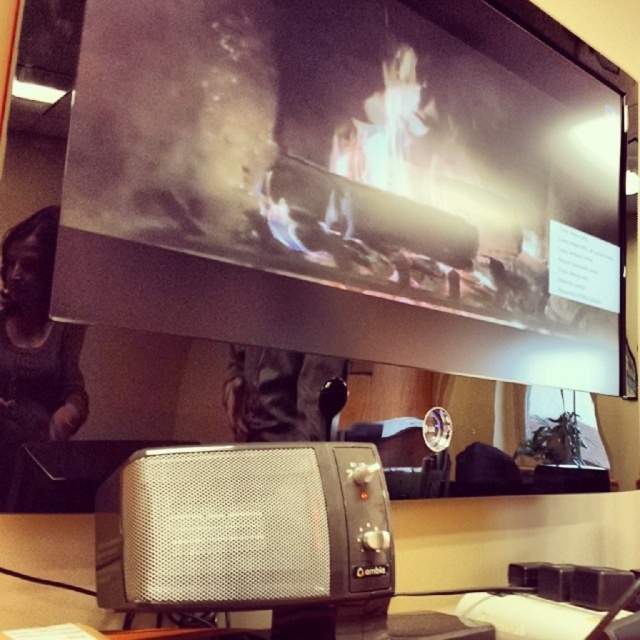
Is metallic glass fireplace at upper center shorter than silver mesh speaker at center?

Incorrect, metallic glass fireplace at upper center's height does not fall short of silver mesh speaker at center's.

Can you confirm if metallic glass fireplace at upper center is smaller than silver mesh speaker at center?

Incorrect, metallic glass fireplace at upper center is not smaller in size than silver mesh speaker at center.

Between point (193, 200) and point (326, 545), which one is positioned behind?

The point (193, 200) is more distant.

Identify the location of metallic glass fireplace at upper center. (346, 186).